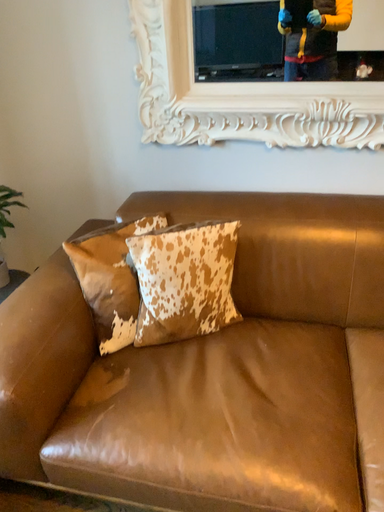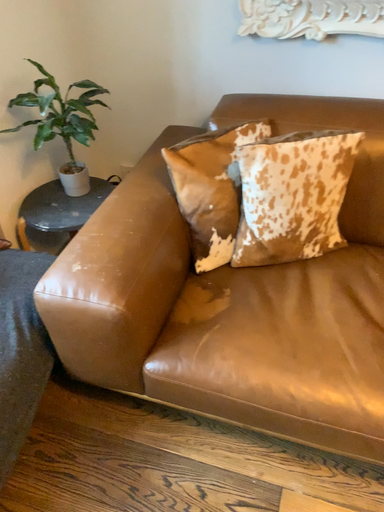
Question: How did the camera likely rotate when shooting the video?

Choices:
 (A) rotated upward
 (B) rotated downward

Answer: (B)